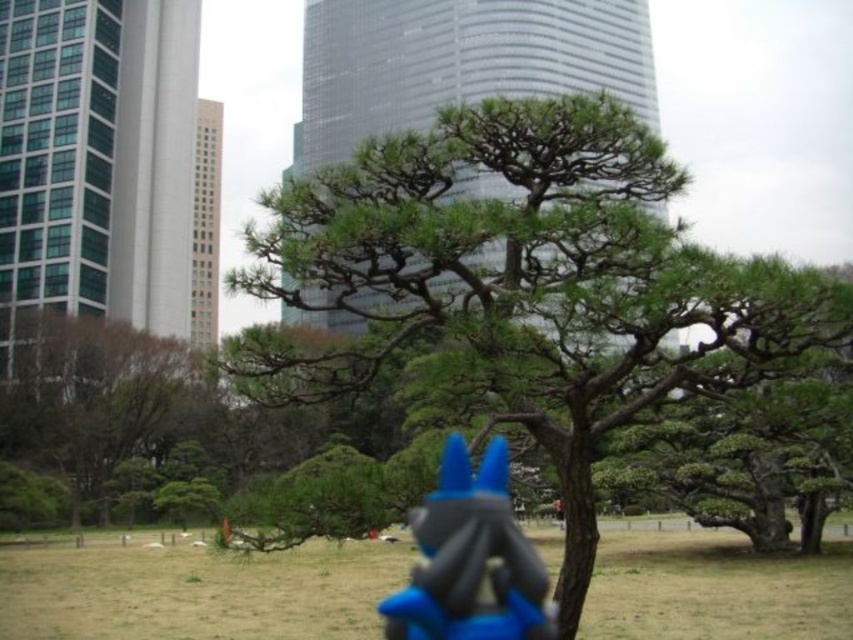
You are standing at the origin point in the image and want to reach the point at the farthest distance from you. Which point should you head towards, point at (4, 422) or point at (476, 577)?

Point at (4, 422) is behind point at (476, 577), so you should head towards point at (4, 422) to reach the farthest distance from your current position.

You are a landscape architect designing a garden. You have to place a green leafy tree at left and a blue plastic toy at center. Considering their widths, which object requires more horizontal space in the garden layout?

The green leafy tree at left requires more horizontal space in the garden layout because its width surpasses that of the blue plastic toy at center.